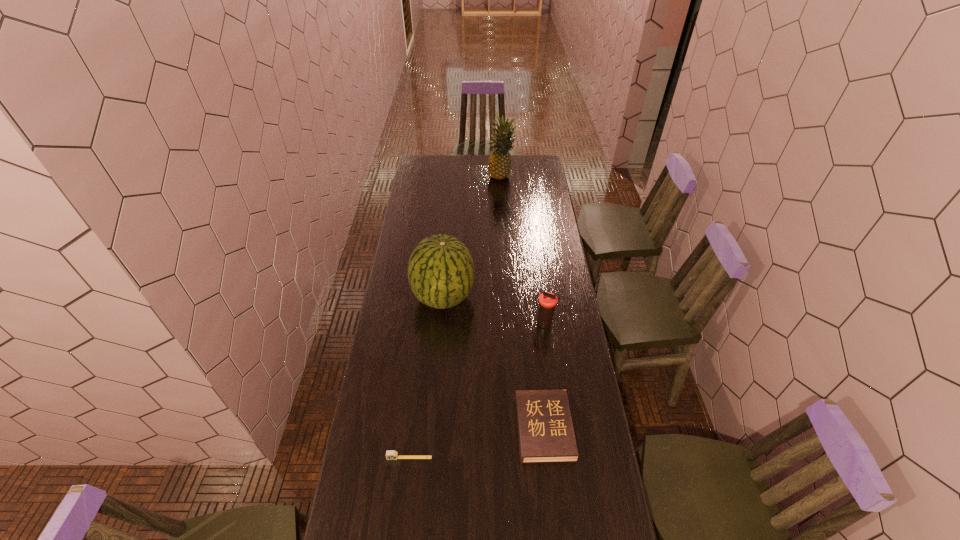
Find the location of a particular element. This screenshot has width=960, height=540. vacant area located 0.090m at the front of the tape measure with the tape extended is located at coordinates (406, 488).

Where is `object that is at the far edge`? The width and height of the screenshot is (960, 540). object that is at the far edge is located at coordinates (499, 165).

At what (x,y) coordinates should I click in order to perform the action: click on watermelon located in the left edge section of the desktop. Please return your answer as a coordinate pair (x, y). The height and width of the screenshot is (540, 960). Looking at the image, I should click on (441, 274).

In order to click on tape measure present at the left edge in this screenshot , I will do `click(390, 454)`.

The width and height of the screenshot is (960, 540). I want to click on thermos bottle that is at the right edge, so click(x=547, y=301).

Locate an element on the screen. The width and height of the screenshot is (960, 540). hardback book present at the right edge is located at coordinates (545, 430).

In the image, there is a desktop. In order to click on free space at the left edge in this screenshot , I will do `click(407, 266)`.

Image resolution: width=960 pixels, height=540 pixels. In order to click on free space at the right edge in this screenshot , I will do `click(548, 214)`.

The width and height of the screenshot is (960, 540). Identify the location of free location at the far right corner. (523, 165).

Where is `free space that is in between the watermelon and the shortest object`? The height and width of the screenshot is (540, 960). free space that is in between the watermelon and the shortest object is located at coordinates (426, 377).